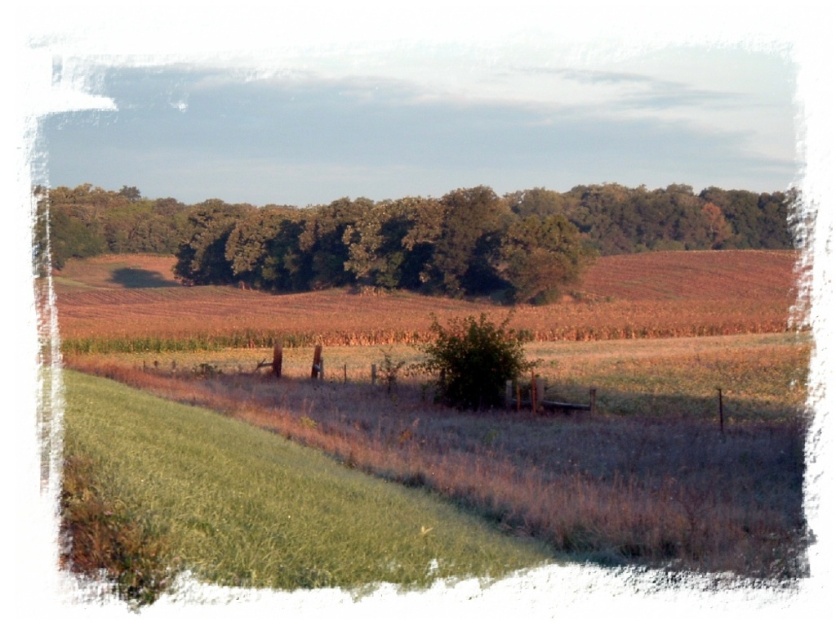
Question: Which point appears farthest from the camera in this image?

Choices:
 (A) (564, 218)
 (B) (340, 481)

Answer: (A)

Question: Does green grass at lower left lie in front of green leafy trees at center?

Choices:
 (A) yes
 (B) no

Answer: (A)

Question: Is green grass at lower left smaller than green leafy trees at center?

Choices:
 (A) yes
 (B) no

Answer: (A)

Question: Is green grass at lower left positioned at the back of green leafy trees at center?

Choices:
 (A) yes
 (B) no

Answer: (B)

Question: Which point is closer to the camera?

Choices:
 (A) green grass at lower left
 (B) green leafy trees at center

Answer: (A)